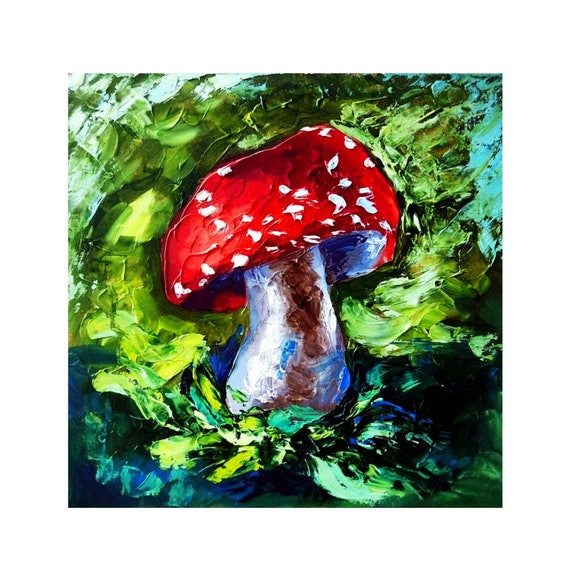
The width and height of the screenshot is (570, 570). In order to click on upper left corner of artwork in this screenshot , I will do `click(69, 73)`.